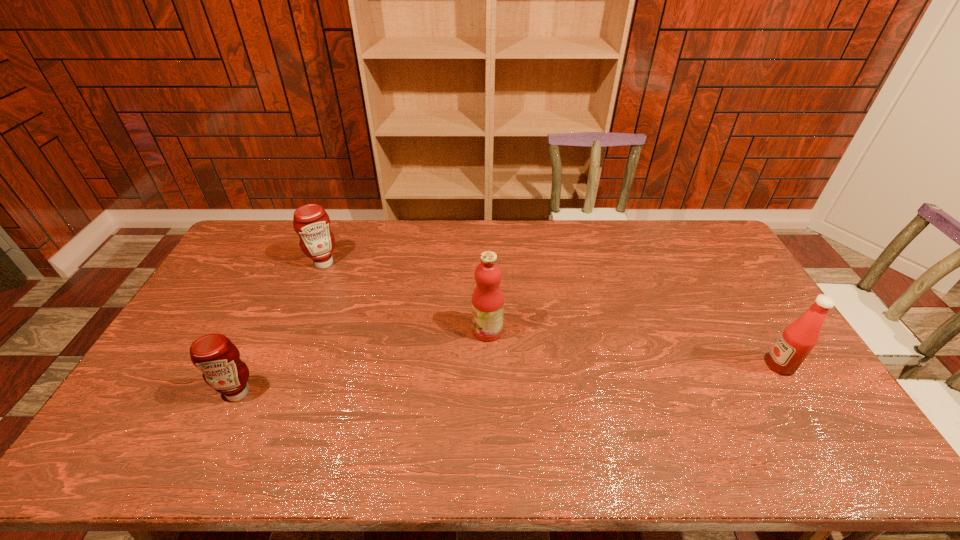
Where is `vacant area that lies between the farthest condiment and the nearest object`? The width and height of the screenshot is (960, 540). vacant area that lies between the farthest condiment and the nearest object is located at coordinates (281, 328).

The width and height of the screenshot is (960, 540). In order to click on free space that is in between the farthest object and the fruit juice in this screenshot , I will do `click(406, 297)`.

This screenshot has height=540, width=960. What are the coordinates of `object that is the second closest one to the nearest condiment` in the screenshot? It's located at (487, 299).

Where is `the third closest object to the nearest object`? This screenshot has height=540, width=960. the third closest object to the nearest object is located at coordinates point(798,339).

Find the location of `condiment that is the closest to the second farthest object`. condiment that is the closest to the second farthest object is located at coordinates (311, 222).

The height and width of the screenshot is (540, 960). I want to click on condiment that is the third closest to the third object from left to right, so click(x=798, y=339).

Find the location of `vacant area that satisfies the following two spatial constraints: 1. on the front-facing side of the second nearest object; 2. on the front side of the nearest condiment`. vacant area that satisfies the following two spatial constraints: 1. on the front-facing side of the second nearest object; 2. on the front side of the nearest condiment is located at coordinates (797, 393).